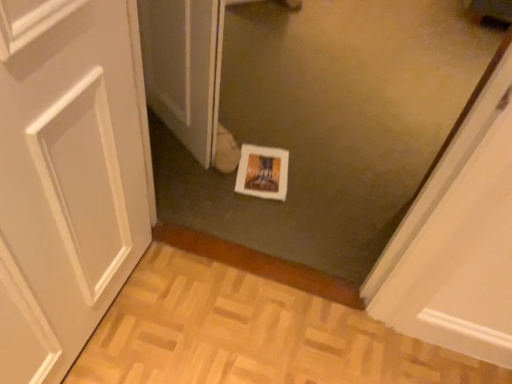
Find the location of a particular element. The width and height of the screenshot is (512, 384). vacant area that lies to the right of white glossy print at center is located at coordinates (313, 177).